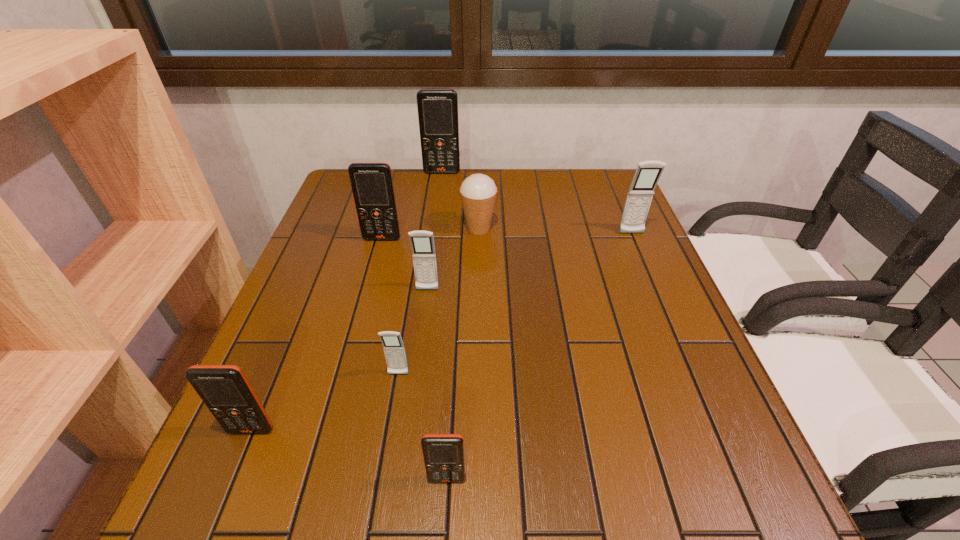
Find the location of a particular element. object that is the sixth closest to the fourth nearest cellular telephone is located at coordinates (640, 194).

Find the location of a particular element. cellular telephone that is the second nearest to the fourth farthest cellular telephone is located at coordinates (394, 350).

Select which cellular telephone appears as the sixth closest to the nearest gray cellular telephone. Please provide its 2D coordinates. Your answer should be formatted as a tuple, i.e. [(x, y)], where the tuple contains the x and y coordinates of a point satisfying the conditions above.

[(437, 108)]

Find the location of a particular element. This screenshot has width=960, height=540. orange cellular telephone that is the second closest to the third farthest orange cellular telephone is located at coordinates (372, 185).

Choose which orange cellular telephone is the fourth nearest neighbor to the rightmost cellular telephone. Please provide its 2D coordinates. Your answer should be formatted as a tuple, i.e. [(x, y)], where the tuple contains the x and y coordinates of a point satisfying the conditions above.

[(225, 390)]

Image resolution: width=960 pixels, height=540 pixels. I want to click on gray cellular telephone that is the nearest to the rightmost gray cellular telephone, so click(422, 242).

The height and width of the screenshot is (540, 960). Identify the location of gray cellular telephone that stands as the second closest to the second object from left to right. (394, 350).

Find the location of a particular element. This screenshot has height=540, width=960. blank space that satisfies the following two spatial constraints: 1. on the screen of the farthest object; 2. on the left side of the icecream is located at coordinates (435, 229).